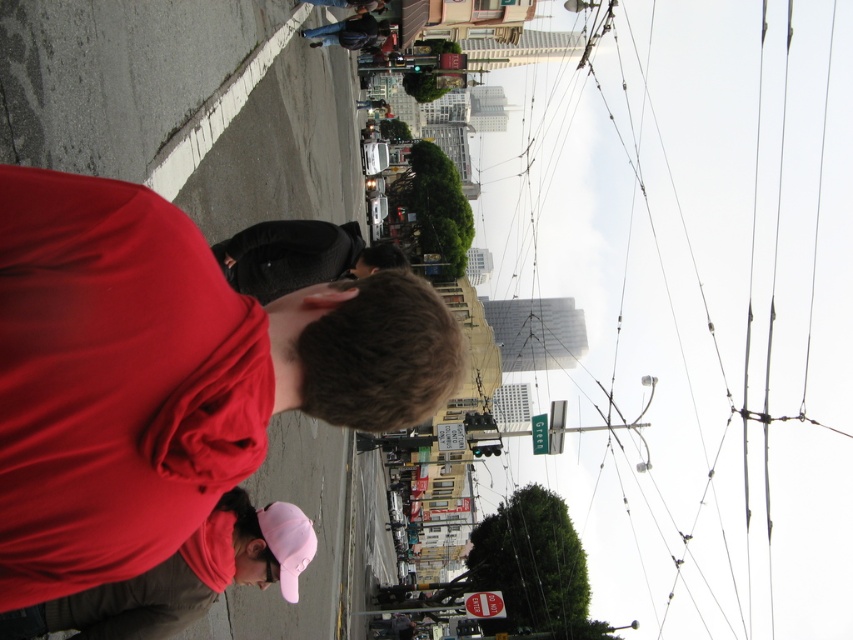
Between matte red shirt at center and black fabric hat at center, which one appears on the left side from the viewer's perspective?

matte red shirt at center

Is point (265, 436) positioned behind point (260, 289)?

No.

This screenshot has width=853, height=640. Find the location of `matte red shirt at center`. matte red shirt at center is located at coordinates (167, 376).